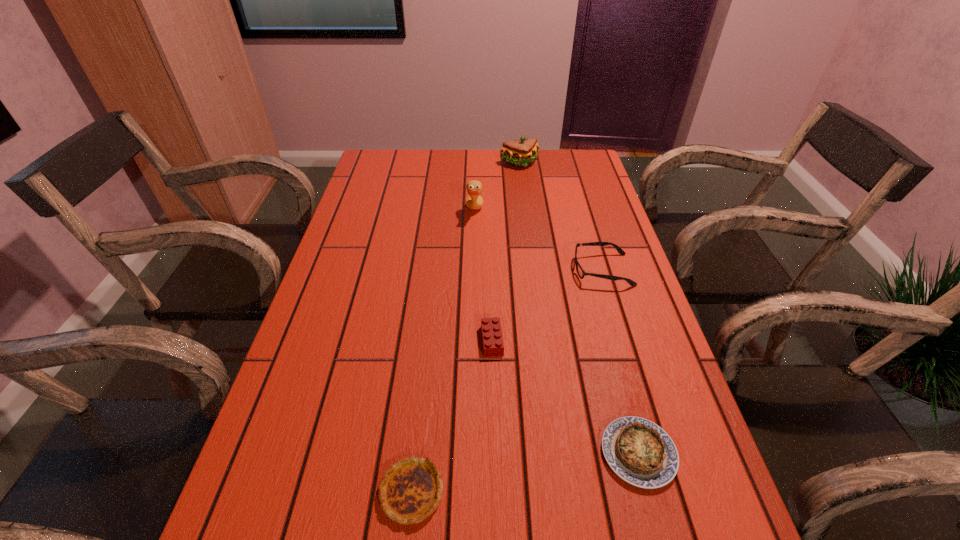
In the image, there is a desktop. At what (x,y) coordinates should I click in order to perform the action: click on blank space at the far edge. Please return your answer as a coordinate pair (x, y). Looking at the image, I should click on (464, 151).

At what (x,y) coordinates should I click in order to perform the action: click on free space at the left edge. Please return your answer as a coordinate pair (x, y). Looking at the image, I should click on (329, 308).

At what (x,y) coordinates should I click in order to perform the action: click on vacant space at the right edge of the desktop. Please return your answer as a coordinate pair (x, y). The width and height of the screenshot is (960, 540). Looking at the image, I should click on (631, 325).

In order to click on vacant area that lies between the left quiche and the right quiche in this screenshot , I will do `click(525, 472)`.

Find the location of a particular element. The height and width of the screenshot is (540, 960). unoccupied position between the left quiche and the third object from right to left is located at coordinates (466, 328).

You are a GUI agent. You are given a task and a screenshot of the screen. Output one action in this format:
    pyautogui.click(x=<x>, y=<y>)
    Task: Click on the vacant area that lies between the spectacles and the Lego
    
    Given the screenshot: What is the action you would take?
    pyautogui.click(x=547, y=305)

Image resolution: width=960 pixels, height=540 pixels. I want to click on unoccupied position between the fourth nearest object and the leftmost object, so click(507, 381).

The height and width of the screenshot is (540, 960). Identify the location of free area in between the left quiche and the right quiche. (525, 472).

The image size is (960, 540). Find the location of `free space between the farthest object and the second farthest object`. free space between the farthest object and the second farthest object is located at coordinates (497, 187).

The width and height of the screenshot is (960, 540). What are the coordinates of `empty space between the spectacles and the left quiche` in the screenshot? It's located at (507, 381).